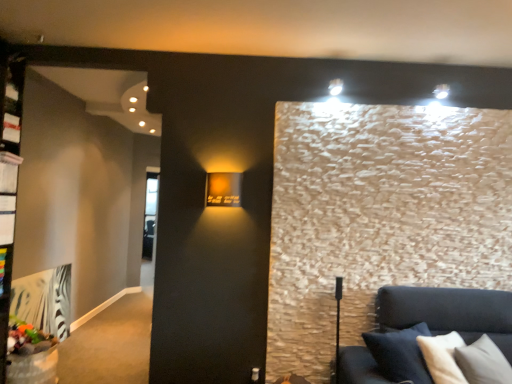
This screenshot has width=512, height=384. In order to click on dark gray fabric studio couch at lower right in this screenshot , I will do `click(448, 312)`.

The width and height of the screenshot is (512, 384). Describe the element at coordinates (448, 312) in the screenshot. I see `dark gray fabric studio couch at lower right` at that location.

What are the coordinates of `dark gray fabric studio couch at lower right` in the screenshot? It's located at (448, 312).